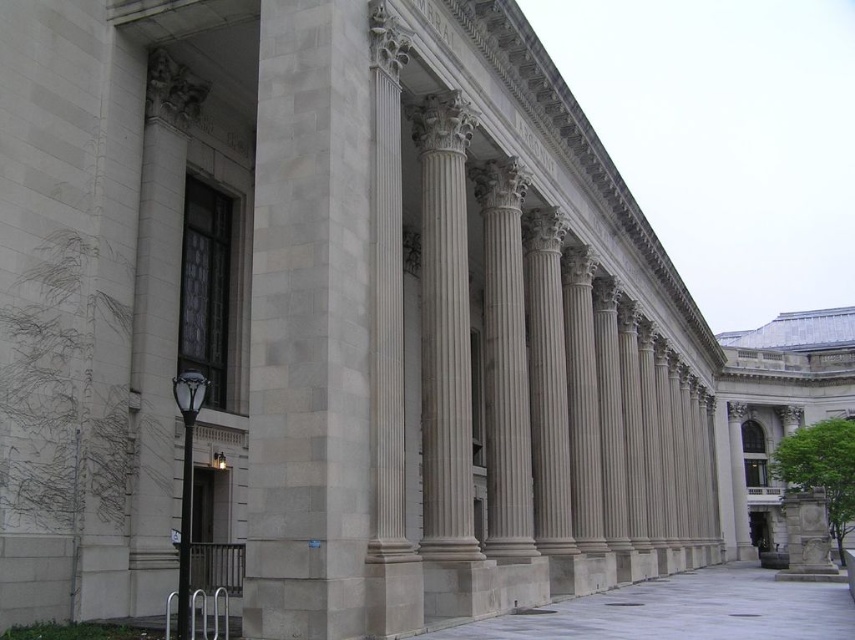
You are an architect examining the building facade. You notice a point at coordinates (x=310, y=324). Which architectural element does this point correspond to?

The point at coordinates (x=310, y=324) corresponds to the white marble column at center.

You are an architect examining the building facade. You need to place a new decorative element exactly at the center of the building. Given the white marble column at center, can you confirm if it is positioned at the exact center of the building?

The white marble column at center is located at point [310,324], which is very close to the exact center coordinates of the building. Therefore, it can be considered as positioned at the exact center for practical purposes.